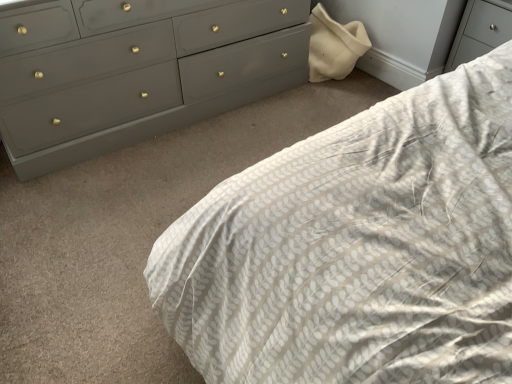
Question: Should I look upward or downward to see white textured fabric at center?

Choices:
 (A) down
 (B) up

Answer: (B)

Question: From a real-world perspective, is white textured fabric at center on top of matte gray dresser at upper left?

Choices:
 (A) no
 (B) yes

Answer: (B)

Question: Is white textured fabric at center turned away from matte gray dresser at upper left?

Choices:
 (A) yes
 (B) no

Answer: (B)

Question: Could you tell me if white textured fabric at center is facing matte gray dresser at upper left?

Choices:
 (A) yes
 (B) no

Answer: (B)

Question: Is white textured fabric at center taller than matte gray dresser at upper left?

Choices:
 (A) no
 (B) yes

Answer: (B)

Question: Is white textured fabric at center bigger than matte gray dresser at upper left?

Choices:
 (A) yes
 (B) no

Answer: (A)

Question: Is white textured fabric at center thinner than matte gray dresser at upper left?

Choices:
 (A) yes
 (B) no

Answer: (B)

Question: Can you confirm if matte gray dresser at upper left is wider than white textured fabric at center?

Choices:
 (A) no
 (B) yes

Answer: (A)

Question: Is matte gray dresser at upper left taller than white textured fabric at center?

Choices:
 (A) yes
 (B) no

Answer: (B)

Question: From a real-world perspective, is matte gray dresser at upper left positioned under white textured fabric at center based on gravity?

Choices:
 (A) yes
 (B) no

Answer: (A)

Question: Is matte gray dresser at upper left thinner than white textured fabric at center?

Choices:
 (A) no
 (B) yes

Answer: (B)

Question: Is matte gray dresser at upper left completely or partially outside of white textured fabric at center?

Choices:
 (A) no
 (B) yes

Answer: (B)

Question: Does matte gray dresser at upper left have a lesser height compared to white textured fabric at center?

Choices:
 (A) no
 (B) yes

Answer: (B)

Question: Is matte gray dresser at upper left bigger or smaller than white textured fabric at center?

Choices:
 (A) small
 (B) big

Answer: (A)